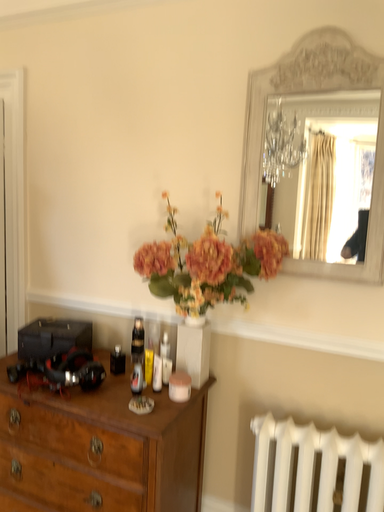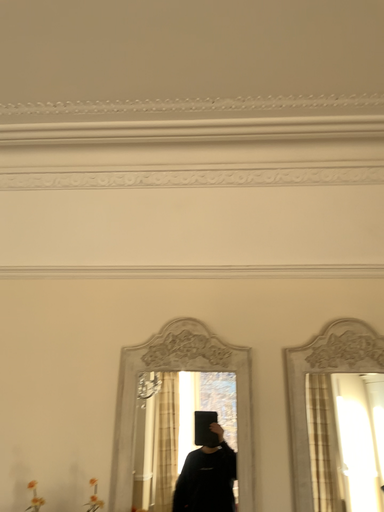
Question: Which way did the camera rotate in the video?

Choices:
 (A) rotated downward
 (B) rotated upward

Answer: (B)